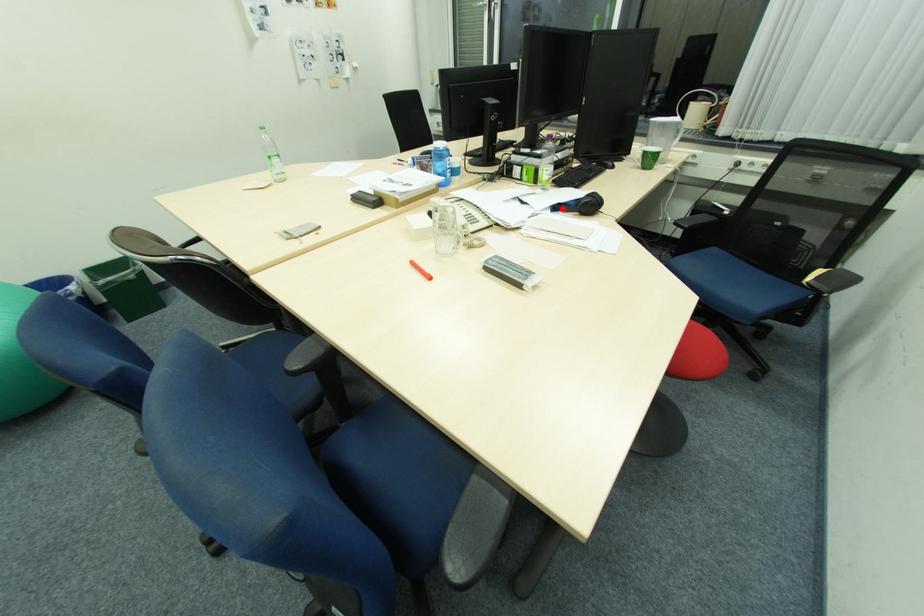
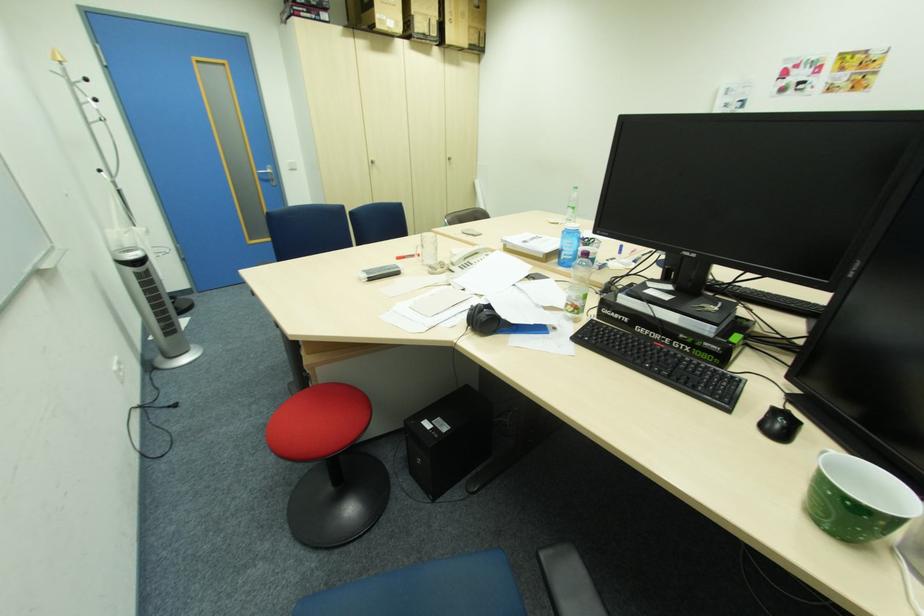
Question: I am providing you with two images of the same scene from different viewpoints. A red point is marked on the first image. Can you still see the location of the red point in image 2?

Choices:
 (A) Yes
 (B) No

Answer: (B)